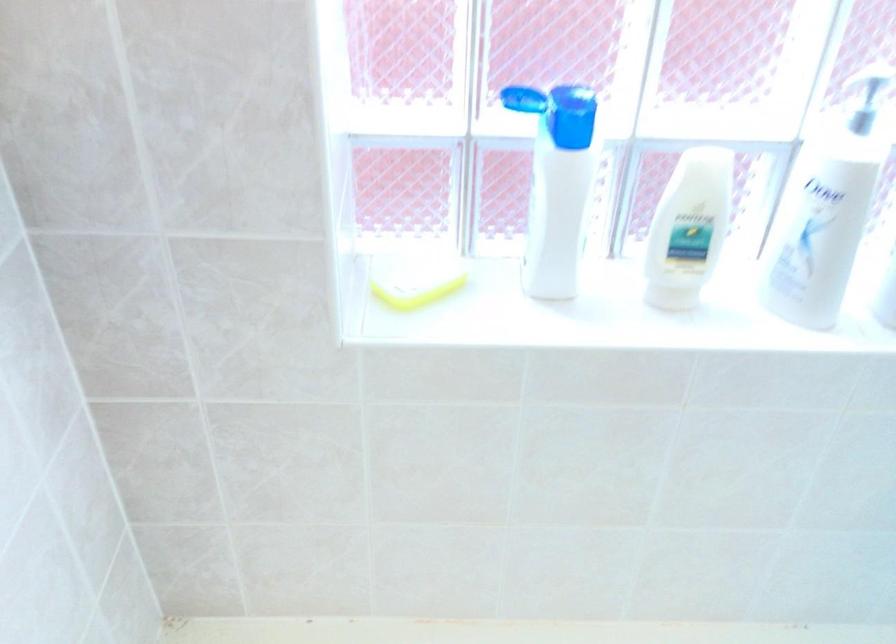
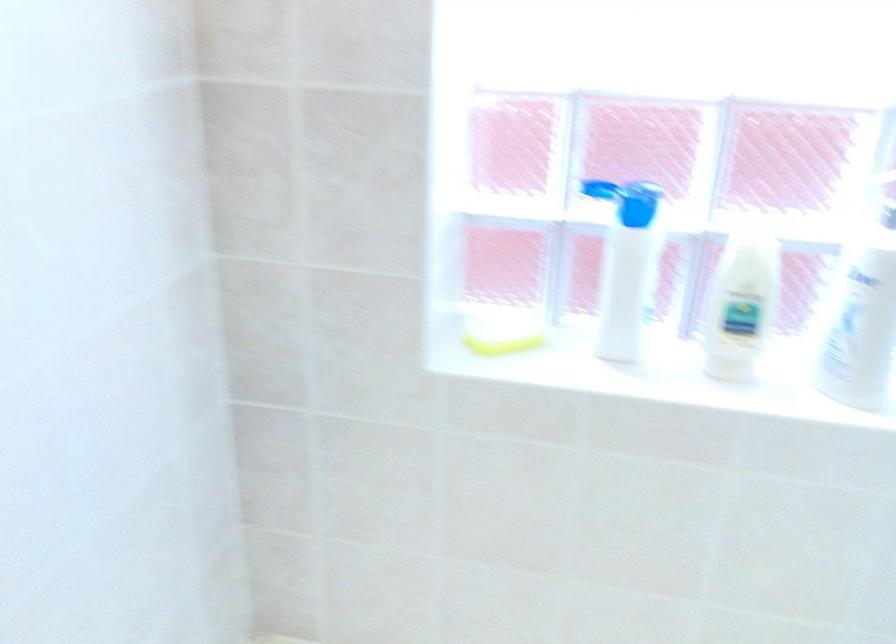
Find the pixel in the second image that matches the point at 688,229 in the first image.

(741, 305)